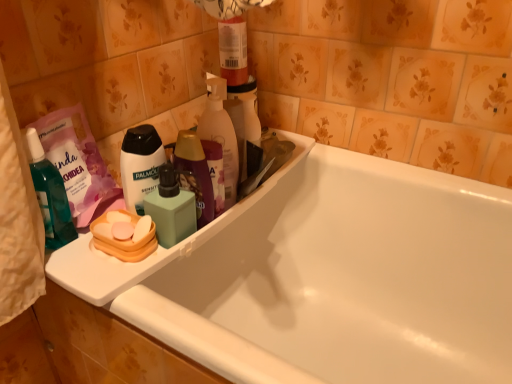
Identify the location of free point above white plastic tray at upper left (from a real-world perspective). This screenshot has width=512, height=384. (215, 195).